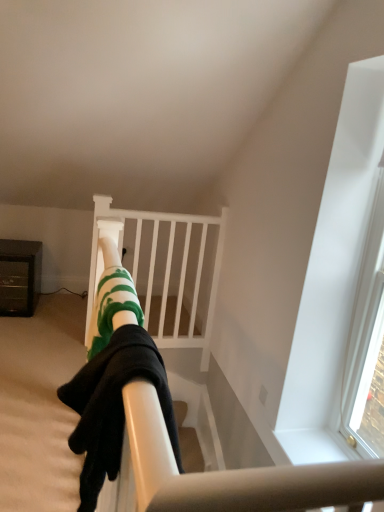
Question: From a real-world perspective, is green striped socks at center under brushed metal cabinet at left?

Choices:
 (A) yes
 (B) no

Answer: (B)

Question: Is green striped socks at center looking in the opposite direction of brushed metal cabinet at left?

Choices:
 (A) yes
 (B) no

Answer: (B)

Question: Is green striped socks at center to the right of brushed metal cabinet at left from the viewer's perspective?

Choices:
 (A) yes
 (B) no

Answer: (A)

Question: Is green striped socks at center not within brushed metal cabinet at left?

Choices:
 (A) no
 (B) yes

Answer: (B)

Question: Is green striped socks at center oriented towards brushed metal cabinet at left?

Choices:
 (A) yes
 (B) no

Answer: (B)

Question: From a real-world perspective, is green striped socks at center on brushed metal cabinet at left?

Choices:
 (A) no
 (B) yes

Answer: (B)

Question: From the image's perspective, is white matte bunk bed at center under green striped socks at center?

Choices:
 (A) no
 (B) yes

Answer: (A)

Question: Considering the relative sizes of white matte bunk bed at center and green striped socks at center in the image provided, is white matte bunk bed at center wider than green striped socks at center?

Choices:
 (A) no
 (B) yes

Answer: (A)

Question: Considering the relative sizes of white matte bunk bed at center and green striped socks at center in the image provided, is white matte bunk bed at center shorter than green striped socks at center?

Choices:
 (A) no
 (B) yes

Answer: (A)

Question: Is white matte bunk bed at center to the right of green striped socks at center from the viewer's perspective?

Choices:
 (A) no
 (B) yes

Answer: (B)

Question: From the image's perspective, would you say white matte bunk bed at center is positioned over green striped socks at center?

Choices:
 (A) no
 (B) yes

Answer: (B)

Question: Is white matte bunk bed at center facing towards green striped socks at center?

Choices:
 (A) yes
 (B) no

Answer: (A)

Question: From the image's perspective, would you say brushed metal cabinet at left is positioned over green striped socks at center?

Choices:
 (A) yes
 (B) no

Answer: (A)